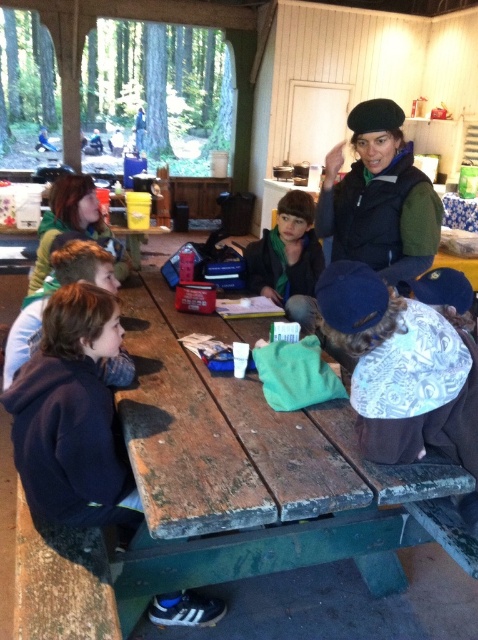
You are standing at the entrance of the cabin and want to reach the dark blue hoodie at lower left without stepping on the wooden picnic table at center. Is this possible?

The wooden picnic table at center is located above the dark blue hoodie at lower left, so you can reach the dark blue hoodie at lower left by going around the table since it is positioned below the table.

You are standing at the entrance of the rustic shelter and want to place a small potted plant on the wooden picnic table at center. Where exactly should you place it so that it sits at the coordinates point [241,438]?

You should place the small potted plant at point [241,438] on the wooden picnic table at center as specified.